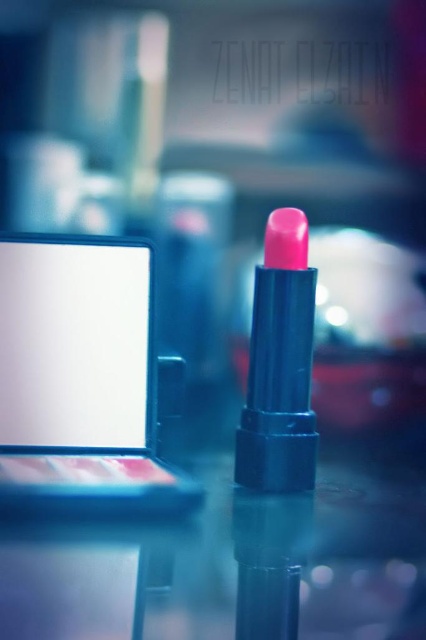
You are holding a smartphone and want to take a photo of the white matte screen at center. The smartphone requires you to be at least 30 inches away to avoid blurring. Based on the scene description, can you take the photo without moving closer or farther away?

The white matte screen at center and viewer are 27.53 inches apart, which is less than the required 30 inches. Therefore, you cannot take the photo without moving farther away to meet the distance requirement.

You are setting up a presentation and need to place the matte pink lipstick at center on top of the white matte screen at center. Given that the screen is larger, will the lipstick fit without overhanging the edges?

The white matte screen at center is bigger than the matte pink lipstick at center, so the lipstick will fit without overhanging the edges since the screen is larger.